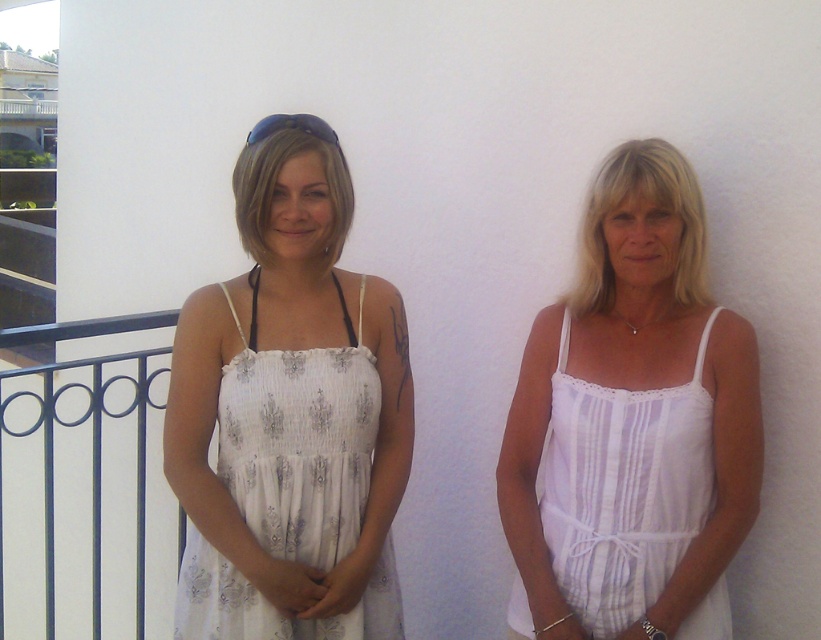
Does white sheer fabric dress at center have a greater height compared to white striped fabric dress at right?

Correct, white sheer fabric dress at center is much taller as white striped fabric dress at right.

Who is shorter, white sheer fabric dress at center or white striped fabric dress at right?

With less height is white striped fabric dress at right.

Who is more distant from viewer, (317, 371) or (666, 420)?

The point (317, 371) is more distant.

This screenshot has height=640, width=821. Find the location of `white sheer fabric dress at center`. white sheer fabric dress at center is located at coordinates (299, 442).